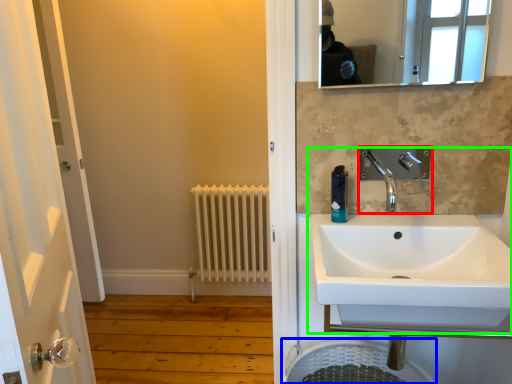
Question: Considering the real-world distances, which object is farthest from tap (highlighted by a red box)? laundry basket (highlighted by a blue box) or sink (highlighted by a green box)?

Choices:
 (A) laundry basket
 (B) sink

Answer: (A)